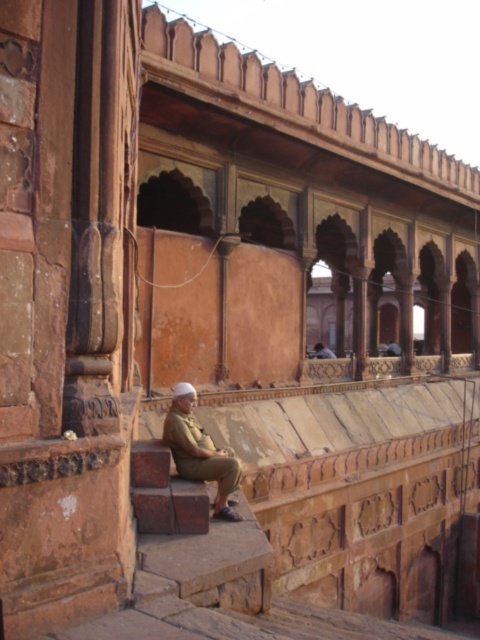
Which of these two, khaki uniform at lower center or khaki uniform at center, stands shorter?

Standing shorter between the two is khaki uniform at lower center.

Is khaki uniform at lower center shorter than khaki uniform at center?

Yes.

Is point (229, 474) farther from camera compared to point (313, 355)?

No.

Locate an element on the screen. khaki uniform at lower center is located at coordinates (200, 451).